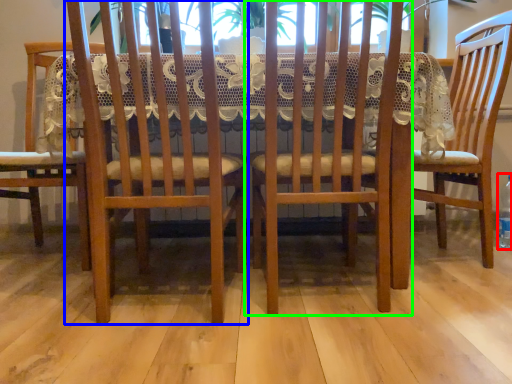
Question: Which object is positioned closest to bottle (highlighted by a red box)? Select from chair (highlighted by a blue box) and chair (highlighted by a green box).

Choices:
 (A) chair
 (B) chair

Answer: (B)